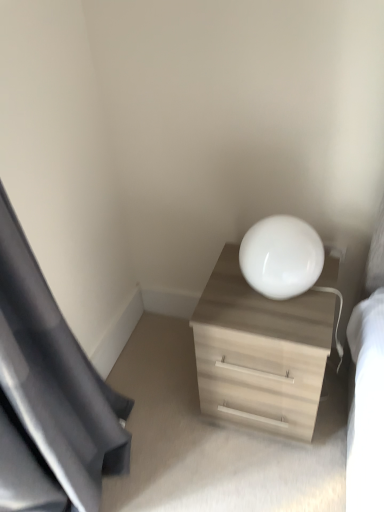
The image size is (384, 512). Identify the location of free space in front of light wood dresser at center. (263, 473).